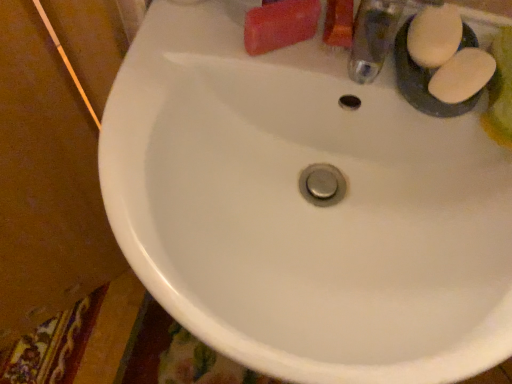
Question: From a real-world perspective, does white matte soap at upper right, which is the 2th soap in left-to-right order, sit lower than matte pink bar of soap at upper right, which ranks as the first soap in left-to-right order?

Choices:
 (A) yes
 (B) no

Answer: (A)

Question: Does white matte soap at upper right, which is the 2th soap in left-to-right order, appear on the left side of matte pink bar of soap at upper right, which ranks as the first soap in left-to-right order?

Choices:
 (A) no
 (B) yes

Answer: (A)

Question: Is white matte soap at upper right, which appears as the 2th soap when viewed from the right, positioned before matte pink bar of soap at upper right, which ranks as the first soap in left-to-right order?

Choices:
 (A) yes
 (B) no

Answer: (A)

Question: Is white matte soap at upper right, which appears as the 2th soap when viewed from the right, taller than matte pink bar of soap at upper right, placed as the third soap when sorted from right to left?

Choices:
 (A) no
 (B) yes

Answer: (A)

Question: From the image's perspective, would you say white matte soap at upper right, which is the 2th soap in left-to-right order, is positioned over matte pink bar of soap at upper right, placed as the third soap when sorted from right to left?

Choices:
 (A) yes
 (B) no

Answer: (B)

Question: Is white matte soap at upper right, which appears as the 2th soap when viewed from the right, shorter than matte pink bar of soap at upper right, which ranks as the first soap in left-to-right order?

Choices:
 (A) no
 (B) yes

Answer: (B)

Question: Does white matte soap at upper right, which appears as the third soap when viewed from the left, have a greater height compared to matte pink bar of soap at upper right, which ranks as the first soap in left-to-right order?

Choices:
 (A) no
 (B) yes

Answer: (A)

Question: Is white matte soap at upper right, which appears as the third soap when viewed from the left, facing away from matte pink bar of soap at upper right, which ranks as the first soap in left-to-right order?

Choices:
 (A) yes
 (B) no

Answer: (B)

Question: Considering the relative sizes of white matte soap at upper right, which is counted as the first soap, starting from the right, and matte pink bar of soap at upper right, placed as the third soap when sorted from right to left, in the image provided, is white matte soap at upper right, which is counted as the first soap, starting from the right, shorter than matte pink bar of soap at upper right, placed as the third soap when sorted from right to left,?

Choices:
 (A) no
 (B) yes

Answer: (B)

Question: Can you confirm if white matte soap at upper right, which appears as the third soap when viewed from the left, is wider than matte pink bar of soap at upper right, which ranks as the first soap in left-to-right order?

Choices:
 (A) yes
 (B) no

Answer: (B)

Question: Does white matte soap at upper right, which is counted as the first soap, starting from the right, come behind matte pink bar of soap at upper right, placed as the third soap when sorted from right to left?

Choices:
 (A) no
 (B) yes

Answer: (A)

Question: Can you confirm if white matte soap at upper right, which appears as the third soap when viewed from the left, is positioned to the left of matte pink bar of soap at upper right, which ranks as the first soap in left-to-right order?

Choices:
 (A) yes
 (B) no

Answer: (B)

Question: Is white matte soap at upper right, which is the 2th soap in left-to-right order, outside white matte soap at upper right, which is counted as the first soap, starting from the right?

Choices:
 (A) no
 (B) yes

Answer: (B)